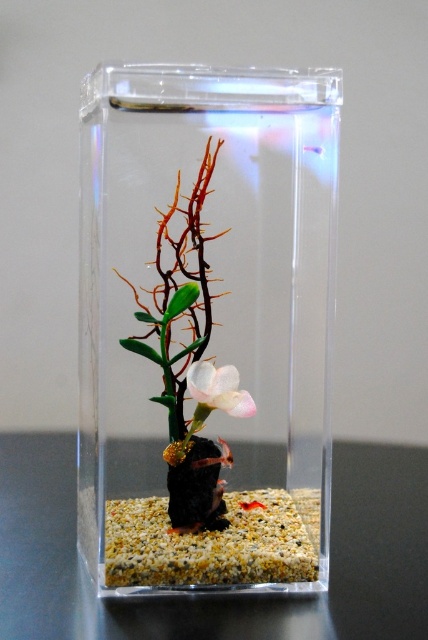
Who is lower down, transparent plastic glass box at center or white matte flower at center?

white matte flower at center is lower down.

Does transparent plastic glass box at center have a greater height compared to white matte flower at center?

Indeed, transparent plastic glass box at center has a greater height compared to white matte flower at center.

Which is behind, point (124, 86) or point (193, 397)?

Positioned behind is point (193, 397).

Locate an element on the screen. The width and height of the screenshot is (428, 640). transparent plastic glass box at center is located at coordinates (205, 324).

Can you confirm if gravelly sand bed at center is positioned to the left of white matte flower at center?

Yes, gravelly sand bed at center is to the left of white matte flower at center.

Does gravelly sand bed at center appear under white matte flower at center?

Yes, gravelly sand bed at center is below white matte flower at center.

Does point (181, 541) lie behind point (205, 378)?

No, it is in front of (205, 378).

Identify the location of gravelly sand bed at center. This screenshot has width=428, height=640. (214, 541).

Can you confirm if transparent plastic glass box at center is positioned below gravelly sand bed at center?

No, transparent plastic glass box at center is not below gravelly sand bed at center.

Can you confirm if transparent plastic glass box at center is positioned above gravelly sand bed at center?

Yes, transparent plastic glass box at center is above gravelly sand bed at center.

Which is behind, point (118, 371) or point (196, 566)?

Point (118, 371)

Where is `transparent plastic glass box at center`? transparent plastic glass box at center is located at coordinates (205, 324).